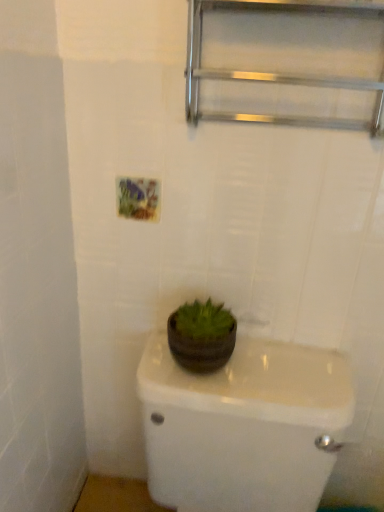
Question: Would you say dark brown matte flowerpot at center contains matte brown pot at center?

Choices:
 (A) yes
 (B) no

Answer: (B)

Question: Considering the relative sizes of dark brown matte flowerpot at center and matte brown pot at center in the image provided, is dark brown matte flowerpot at center taller than matte brown pot at center?

Choices:
 (A) yes
 (B) no

Answer: (B)

Question: Is dark brown matte flowerpot at center to the right of matte brown pot at center from the viewer's perspective?

Choices:
 (A) yes
 (B) no

Answer: (B)

Question: Does dark brown matte flowerpot at center have a lesser width compared to matte brown pot at center?

Choices:
 (A) yes
 (B) no

Answer: (A)

Question: Is dark brown matte flowerpot at center smaller than matte brown pot at center?

Choices:
 (A) yes
 (B) no

Answer: (A)

Question: Is metallic silver shelf at upper center taller or shorter than matte brown pot at center?

Choices:
 (A) tall
 (B) short

Answer: (B)

Question: In the image, is metallic silver shelf at upper center positioned in front of or behind matte brown pot at center?

Choices:
 (A) behind
 (B) front

Answer: (A)

Question: Would you say metallic silver shelf at upper center is inside or outside matte brown pot at center?

Choices:
 (A) inside
 (B) outside

Answer: (B)

Question: Considering the positions of point (380, 77) and point (289, 420), is point (380, 77) closer or farther from the camera than point (289, 420)?

Choices:
 (A) closer
 (B) farther

Answer: (A)

Question: In terms of width, does dark brown matte flowerpot at center look wider or thinner when compared to matte brown pot at center?

Choices:
 (A) thin
 (B) wide

Answer: (A)

Question: Based on their sizes in the image, would you say dark brown matte flowerpot at center is bigger or smaller than matte brown pot at center?

Choices:
 (A) big
 (B) small

Answer: (B)

Question: Considering the relative positions of dark brown matte flowerpot at center and matte brown pot at center in the image provided, is dark brown matte flowerpot at center to the left or to the right of matte brown pot at center?

Choices:
 (A) left
 (B) right

Answer: (A)

Question: Is dark brown matte flowerpot at center inside or outside of matte brown pot at center?

Choices:
 (A) outside
 (B) inside

Answer: (A)

Question: From their relative heights in the image, would you say dark brown matte flowerpot at center is taller or shorter than metallic silver shelf at upper center?

Choices:
 (A) short
 (B) tall

Answer: (A)

Question: Looking at their shapes, would you say dark brown matte flowerpot at center is wider or thinner than metallic silver shelf at upper center?

Choices:
 (A) thin
 (B) wide

Answer: (B)